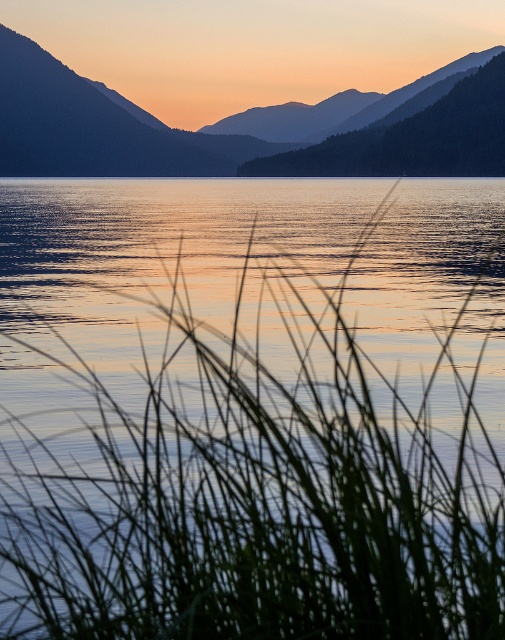
Question: Which point appears farthest from the camera in this image?

Choices:
 (A) (126, 100)
 (B) (496, 323)

Answer: (A)

Question: Does green grass at center have a greater width compared to silvery metallic mountain at upper left?

Choices:
 (A) no
 (B) yes

Answer: (A)

Question: Does green grass at center appear on the left side of silvery metallic mountain at upper left?

Choices:
 (A) yes
 (B) no

Answer: (B)

Question: Does green grass at center have a lesser width compared to silvery metallic mountain at upper left?

Choices:
 (A) yes
 (B) no

Answer: (A)

Question: Which of the following is the closest to the observer?

Choices:
 (A) green grass at center
 (B) silvery metallic mountain at upper left

Answer: (A)